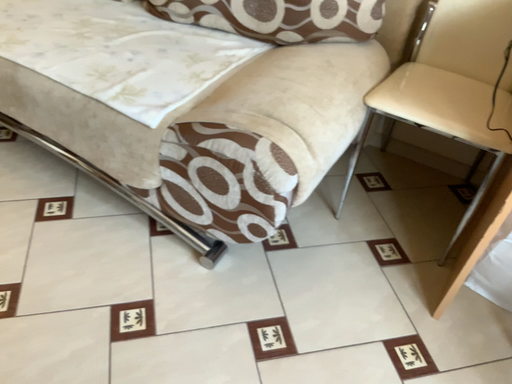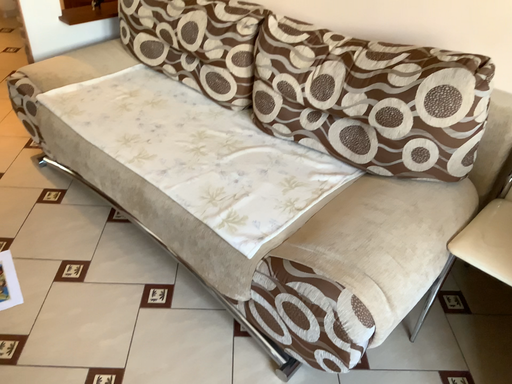
Question: Which way did the camera rotate in the video?

Choices:
 (A) rotated left
 (B) rotated right

Answer: (A)